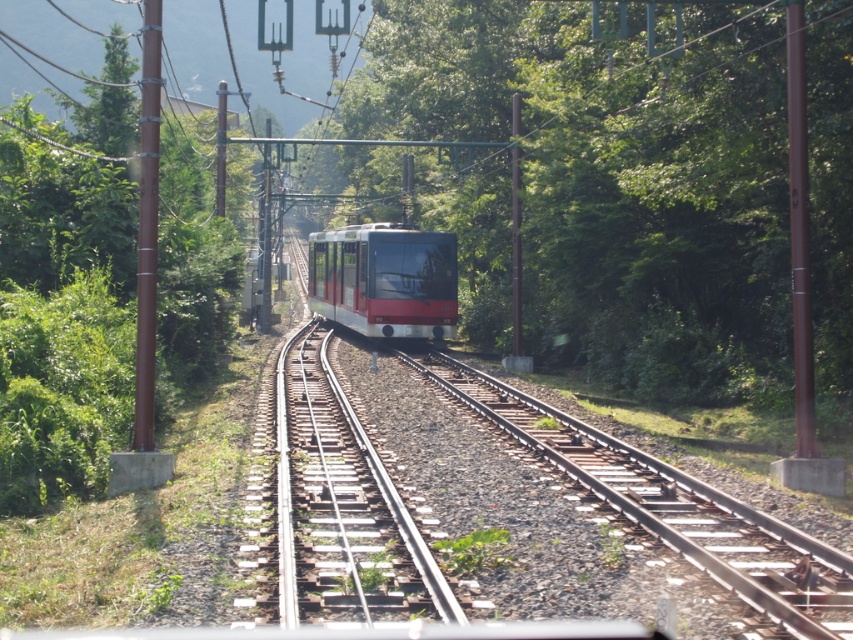
Question: Can you confirm if green leafy tree at center is positioned to the left of metallic train track at center?

Choices:
 (A) no
 (B) yes

Answer: (A)

Question: Which object is the farthest from the metallic train track at center?

Choices:
 (A) green leafy tree at center
 (B) smooth metal train track at center

Answer: (A)

Question: Which of the following is the closest to the observer?

Choices:
 (A) (306, 378)
 (B) (776, 20)
 (C) (363, 248)
 (D) (819, 556)

Answer: (D)

Question: Does green leafy tree at center appear on the left side of smooth metal train track at center?

Choices:
 (A) yes
 (B) no

Answer: (A)

Question: Can you confirm if green leafy tree at center is positioned to the right of smooth metal train track at center?

Choices:
 (A) no
 (B) yes

Answer: (A)

Question: Which is farther from the smooth metal train track at center?

Choices:
 (A) metallic train track at center
 (B) red glossy tram at center

Answer: (B)